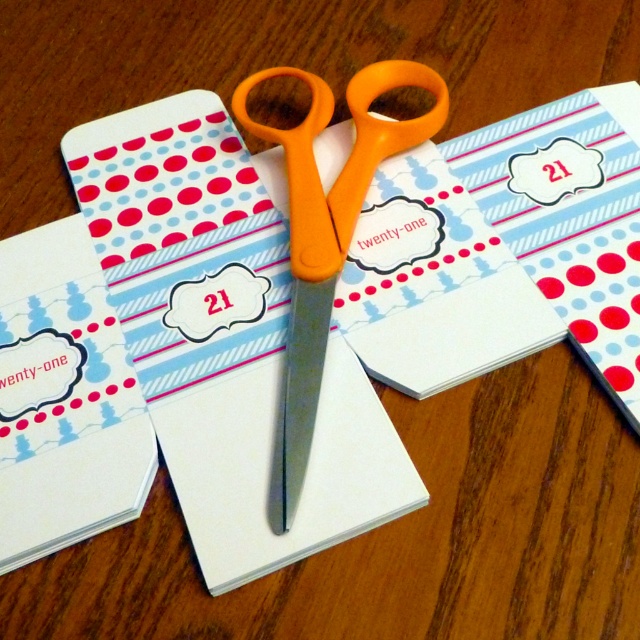
You are designing a card set and need to place both the matte paper envelope at center and the orange plastic scissors at center on the same table. If you want to ensure the envelope is visible, which object should you place higher?

The matte paper envelope at center is larger than the orange plastic scissors at center, so to ensure visibility, place the matte paper envelope at center higher so it isn

You are organizing mail and see two envelopes, the matte paper envelope at center and the matte white envelope at center. Which one is positioned higher?

The matte paper envelope at center is located above the matte white envelope at center, so it is positioned higher.

You need to mail a letter using the matte paper envelope at center. However, you notice the orange plastic scissors at center might interfere with the sealing process. Which item is taller, and could this affect how you seal the envelope?

The matte paper envelope at center is taller than the orange plastic scissors at center. Since the envelope is taller, you should ensure that when sealing it, the scissors are moved aside to avoid any obstruction.